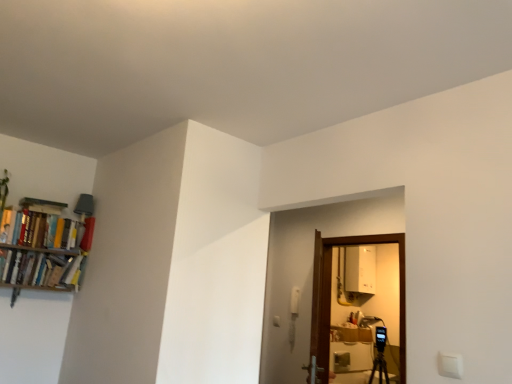
Question: From the image's perspective, relative to matte red book at upper left, which appears as the second book when ordered from the bottom, is hardcover books at left, which is the 1th book from top to bottom, above or below?

Choices:
 (A) below
 (B) above

Answer: (B)

Question: Is point (17, 231) closer or farther from the camera than point (83, 220)?

Choices:
 (A) farther
 (B) closer

Answer: (B)

Question: Which is farther from the hardcover books at left, which is the 1th book from top to bottom?

Choices:
 (A) hardcover books at left, which appears as the third book when viewed from the top
 (B) matte red book at upper left, which appears as the second book when ordered from the bottom

Answer: (B)

Question: Which of these objects is positioned farthest from the hardcover books at left, which ranks as the 3th book in bottom-to-top order?

Choices:
 (A) matte red book at upper left, which appears as the second book when ordered from the bottom
 (B) hardcover books at left, which is the 1th book in bottom-to-top order

Answer: (A)